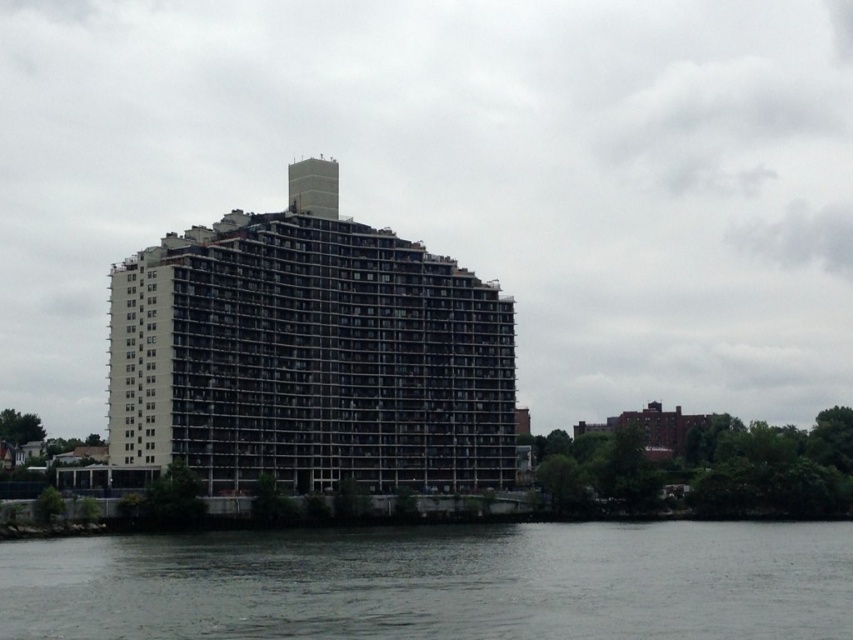
You are standing at the point marked by the coordinates (309, 355) in the image. What type of structure are you facing?

The point marked by the coordinates (309, 355) indicates a gray concrete building at the center of the image.

You are a construction inspector evaluating the waterfront site. You observe the gray concrete building at center and the gray water at lower center. Which of these two objects has a smaller width in the image?

The gray concrete building at center has a lesser width compared to the gray water at lower center, so the gray concrete building at center is the one with the smaller width.